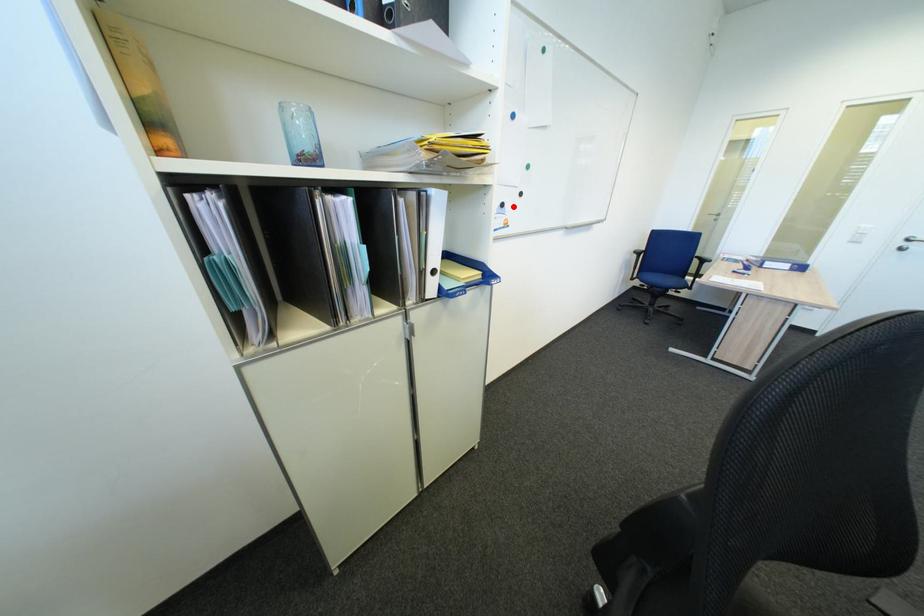
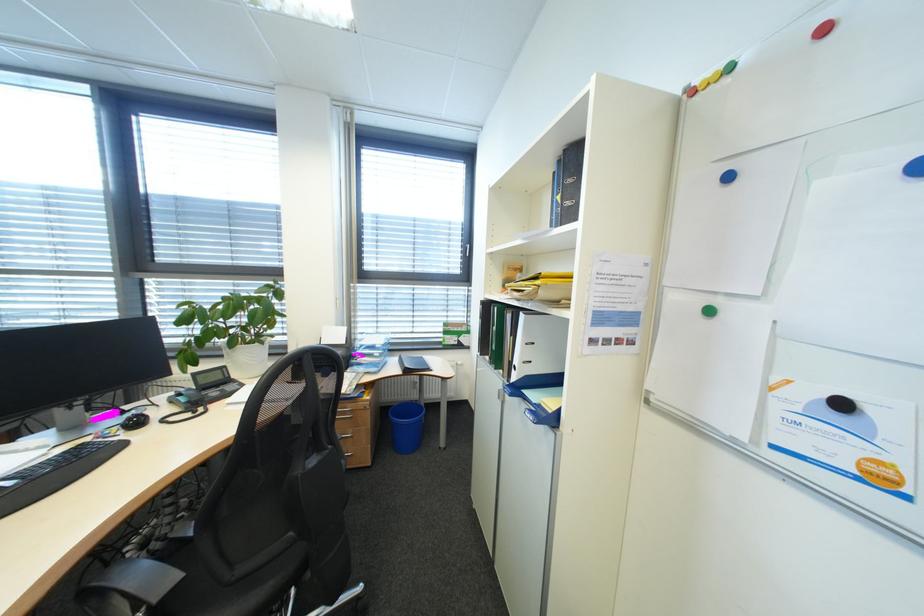
Find the pixel in the second image that matches the highlighted location in the first image.

(854, 406)